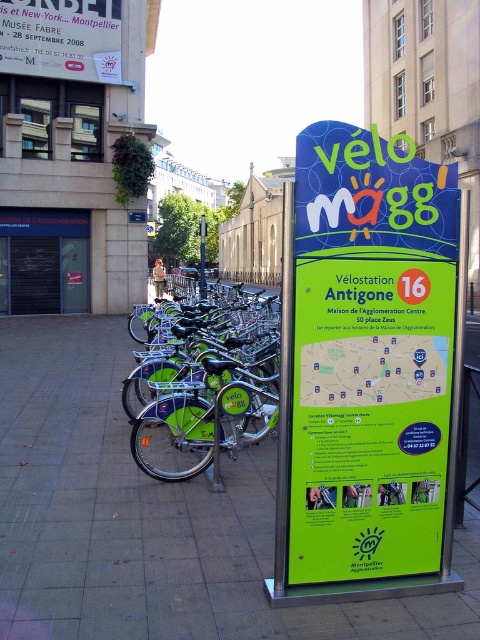
Which is more to the left, green plastic sign at center or green matte bicycle at center?

green matte bicycle at center is more to the left.

You are a GUI agent. You are given a task and a screenshot of the screen. Output one action in this format:
    pyautogui.click(x=<x>, y=<y>)
    Task: Click on the green plastic sign at center
    The width and height of the screenshot is (480, 640).
    Given the screenshot: What is the action you would take?
    (x=370, y=358)

Is point (384, 225) closer to camera compared to point (169, 401)?

Yes, it is.

This screenshot has width=480, height=640. Find the location of `green plastic sign at center`. green plastic sign at center is located at coordinates (370, 358).

Is green metal pavement at center above metallic gray bus stop at left?

Incorrect, green metal pavement at center is not positioned above metallic gray bus stop at left.

Is green metal pavement at center bigger than metallic gray bus stop at left?

Yes, green metal pavement at center is bigger than metallic gray bus stop at left.

You are a GUI agent. You are given a task and a screenshot of the screen. Output one action in this format:
    pyautogui.click(x=<x>, y=<y>)
    Task: Click on the green metal pavement at center
    
    Given the screenshot: What is the action you would take?
    pyautogui.click(x=151, y=518)

Is green plastic sign at center above metallic gray bus stop at left?

Yes.

Find the location of `green plastic sign at center`. green plastic sign at center is located at coordinates click(370, 358).